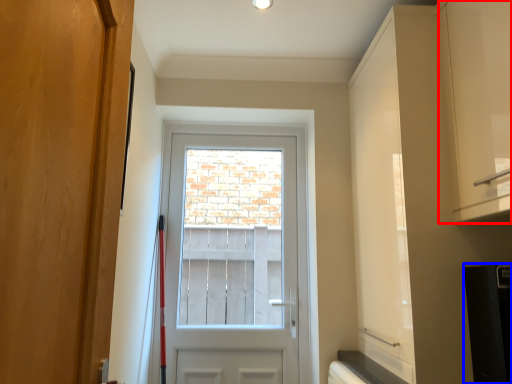
Question: Which object appears farthest to the camera in this image, cabinetry (highlighted by a red box) or appliance (highlighted by a blue box)?

Choices:
 (A) cabinetry
 (B) appliance

Answer: (B)